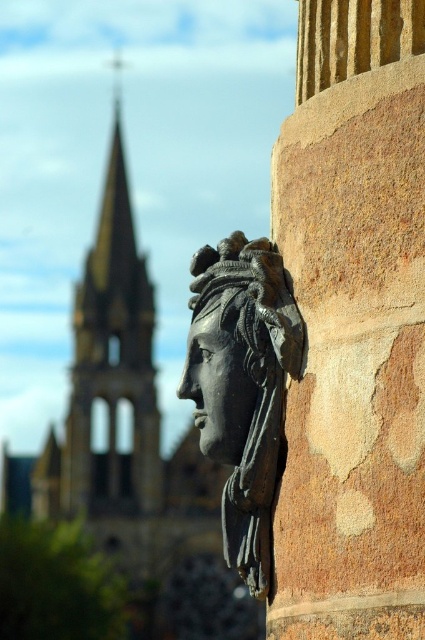
Is black stone head at center closer to the viewer compared to golden stone tower at left?

Yes, black stone head at center is closer to the viewer.

Does point (223, 422) come behind point (130, 209)?

No, (223, 422) is closer to viewer.

Does point (206, 296) come farther from viewer compared to point (133, 432)?

No, it is not.

Identify the location of black stone head at center. The height and width of the screenshot is (640, 425). (243, 387).

From the picture: Is brown rough stone column at right closer to camera compared to black polished stone face at center?

Yes.

Does point (303, 170) come farther from viewer compared to point (221, 362)?

No, (303, 170) is closer to viewer.

Is point (323, 20) in front of point (201, 417)?

Yes, it is in front of point (201, 417).

This screenshot has height=640, width=425. Identify the location of brown rough stone column at right. (354, 324).

Is golden stone tower at left shorter than black polished stone face at center?

In fact, golden stone tower at left may be taller than black polished stone face at center.

Which is below, golden stone tower at left or black polished stone face at center?

black polished stone face at center is below.

Is point (107, 282) farther from camera compared to point (197, 323)?

That is True.

Where is `golden stone tower at left`? golden stone tower at left is located at coordinates (113, 358).